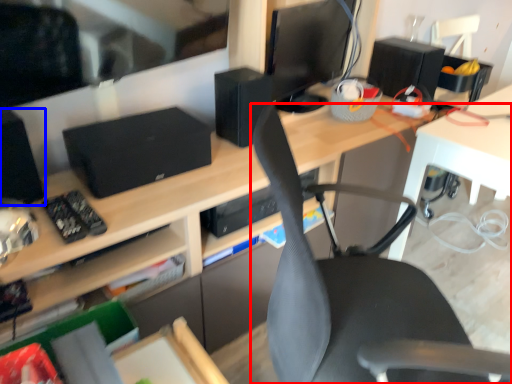
Question: Which point is closer to the camera, chair (highlighted by a red box) or speaker (highlighted by a blue box)?

Choices:
 (A) chair
 (B) speaker

Answer: (A)